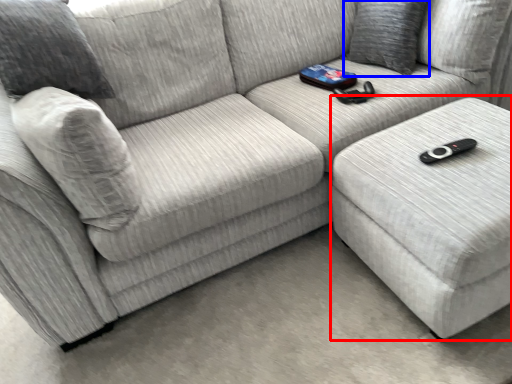
Question: Which point is closer to the camera, table (highlighted by a red box) or pillow (highlighted by a blue box)?

Choices:
 (A) table
 (B) pillow

Answer: (A)